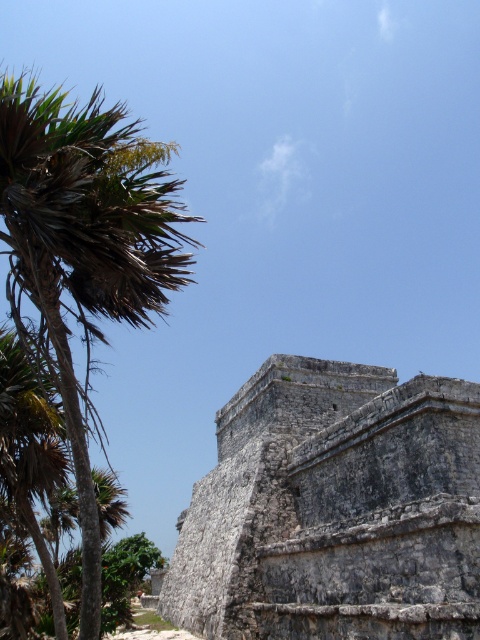
Question: Which object is farther from the camera taking this photo?

Choices:
 (A) green leafy palm at left
 (B) gray stone ruins at center

Answer: (A)

Question: Does gray stone ruins at center have a greater width compared to green leafy palm at left?

Choices:
 (A) yes
 (B) no

Answer: (B)

Question: Is gray stone ruins at center thinner than green leafy palm at left?

Choices:
 (A) no
 (B) yes

Answer: (B)

Question: Is gray stone ruins at center above green leafy palm at left?

Choices:
 (A) no
 (B) yes

Answer: (A)